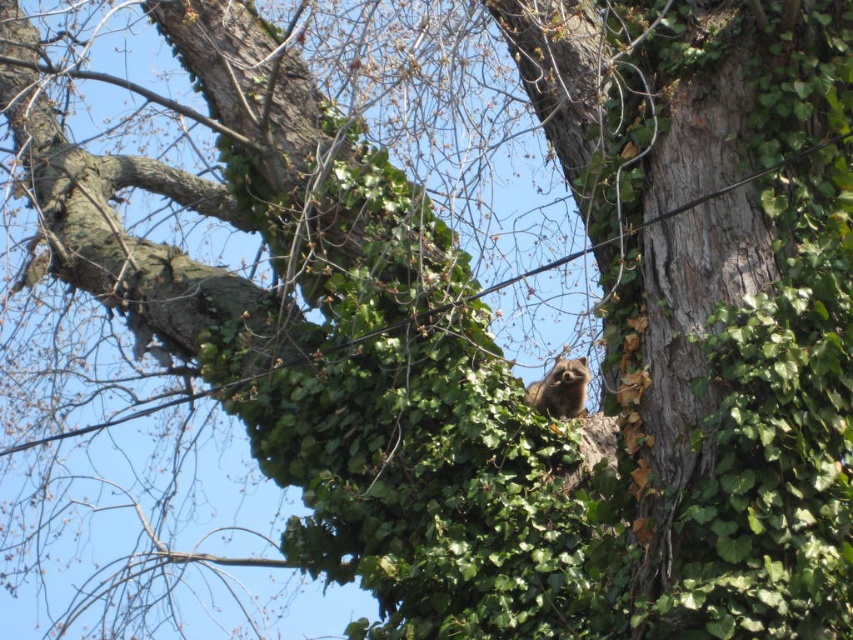
Question: Does brown rough bark at center appear over fuzzy brown squirrel at center-right?

Choices:
 (A) no
 (B) yes

Answer: (B)

Question: Which point is farther to the camera?

Choices:
 (A) (535, 401)
 (B) (758, 260)

Answer: (A)

Question: Among these objects, which one is nearest to the camera?

Choices:
 (A) brown rough bark at center
 (B) fuzzy brown squirrel at center-right

Answer: (A)

Question: Can you confirm if brown rough bark at center is smaller than fuzzy brown squirrel at center-right?

Choices:
 (A) no
 (B) yes

Answer: (A)

Question: Among these points, which one is nearest to the camera?

Choices:
 (A) (576, 371)
 (B) (717, 177)

Answer: (B)

Question: Does brown rough bark at center appear on the left side of fuzzy brown squirrel at center-right?

Choices:
 (A) no
 (B) yes

Answer: (A)